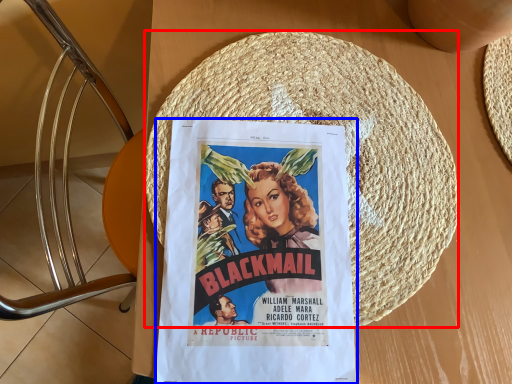
Question: Among these objects, which one is farthest to the camera, straw hat (highlighted by a red box) or poster (highlighted by a blue box)?

Choices:
 (A) straw hat
 (B) poster

Answer: (A)